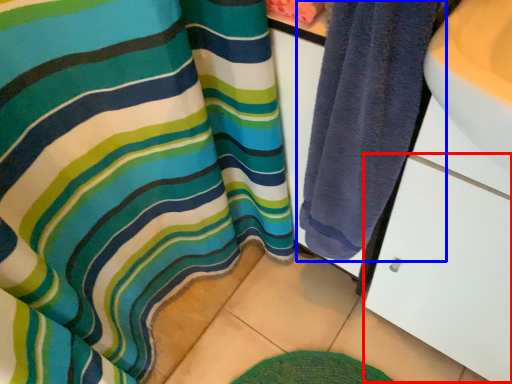
Question: Among these objects, which one is farthest to the camera, drawer (highlighted by a red box) or towel (highlighted by a blue box)?

Choices:
 (A) drawer
 (B) towel

Answer: (B)